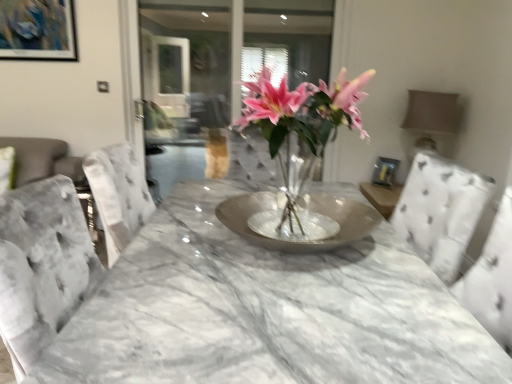
Question: Is pink glass vase at center located outside metallic silver picture frame at upper left?

Choices:
 (A) no
 (B) yes

Answer: (B)

Question: Is pink glass vase at center bigger than metallic silver picture frame at upper left?

Choices:
 (A) no
 (B) yes

Answer: (B)

Question: Is metallic silver picture frame at upper left a part of pink glass vase at center?

Choices:
 (A) yes
 (B) no

Answer: (B)

Question: Can you confirm if pink glass vase at center is smaller than metallic silver picture frame at upper left?

Choices:
 (A) no
 (B) yes

Answer: (A)

Question: Is pink glass vase at center shorter than metallic silver picture frame at upper left?

Choices:
 (A) yes
 (B) no

Answer: (B)

Question: Is the depth of pink glass vase at center less than that of metallic silver picture frame at upper left?

Choices:
 (A) no
 (B) yes

Answer: (B)

Question: Would you say metallic silver picture frame at upper left is a long distance from transparent glass door at upper center?

Choices:
 (A) yes
 (B) no

Answer: (A)

Question: Is metallic silver picture frame at upper left oriented towards transparent glass door at upper center?

Choices:
 (A) yes
 (B) no

Answer: (B)

Question: Is metallic silver picture frame at upper left at the right side of transparent glass door at upper center?

Choices:
 (A) yes
 (B) no

Answer: (B)

Question: Is metallic silver picture frame at upper left smaller than transparent glass door at upper center?

Choices:
 (A) no
 (B) yes

Answer: (B)

Question: Can you confirm if metallic silver picture frame at upper left is wider than transparent glass door at upper center?

Choices:
 (A) yes
 (B) no

Answer: (B)

Question: Does metallic silver picture frame at upper left lie in front of transparent glass door at upper center?

Choices:
 (A) no
 (B) yes

Answer: (B)

Question: Considering the relative sizes of pink glass vase at center and transparent glass door at upper center in the image provided, is pink glass vase at center bigger than transparent glass door at upper center?

Choices:
 (A) no
 (B) yes

Answer: (B)